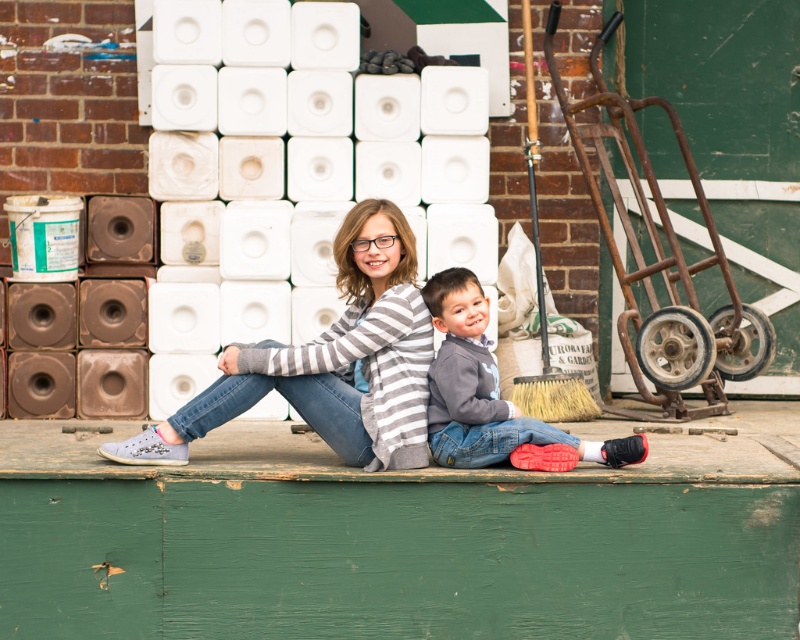
Question: Among these points, which one is farthest from the camera?

Choices:
 (A) click(426, 326)
 (B) click(506, 408)

Answer: (A)

Question: Is green painted wood at center thinner than striped sweater at center?

Choices:
 (A) yes
 (B) no

Answer: (B)

Question: Does green painted wood at center appear on the left side of gray fleece sweater at center?

Choices:
 (A) no
 (B) yes

Answer: (B)

Question: Among these objects, which one is farthest from the camera?

Choices:
 (A) gray fleece sweater at center
 (B) striped sweater at center

Answer: (B)

Question: Which point is closer to the camera?

Choices:
 (A) (408, 259)
 (B) (468, 339)
 (C) (616, 566)

Answer: (C)

Question: Does green painted wood at center have a lesser width compared to striped sweater at center?

Choices:
 (A) yes
 (B) no

Answer: (B)